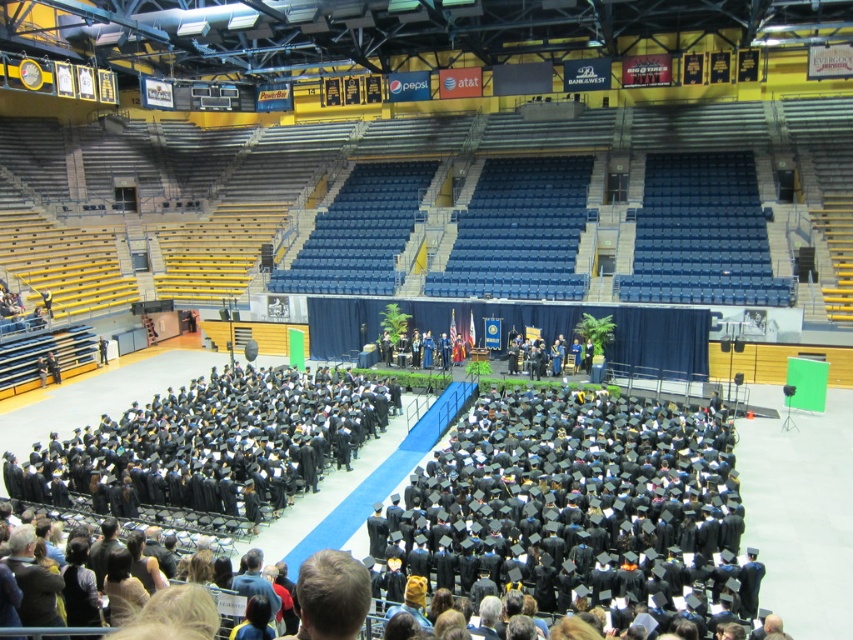
Question: Is black matte graduation gowns at center bigger than black matte graduation gowns at lower left?

Choices:
 (A) no
 (B) yes

Answer: (B)

Question: Among these points, which one is nearest to the camera?

Choices:
 (A) (721, 534)
 (B) (173, 504)

Answer: (A)

Question: Does black matte graduation gowns at center appear over black matte graduation gowns at lower left?

Choices:
 (A) no
 (B) yes

Answer: (A)

Question: Is black matte graduation gowns at center smaller than black matte graduation gowns at lower left?

Choices:
 (A) yes
 (B) no

Answer: (B)

Question: Which of the following is the closest to the observer?

Choices:
 (A) (686, 589)
 (B) (293, 403)

Answer: (A)

Question: Among these points, which one is farthest from the camera?

Choices:
 (A) (453, 472)
 (B) (271, 374)

Answer: (B)